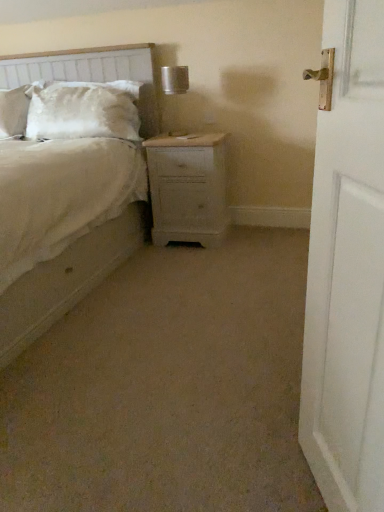
This screenshot has width=384, height=512. What are the coordinates of `beige fabric bed at center` in the screenshot? It's located at (67, 280).

In order to face light wood nightstand at center, should I rotate leftwards or rightwards?

To face it directly, rotate right by 0.158 degrees.

At what (x,y) coordinates should I click in order to perform the action: click on textured fabric headboard at upper left. Please return your answer as a coordinate pair (x, y). This screenshot has width=384, height=512. Looking at the image, I should click on (92, 73).

Where is `metallic silver table lamp at upper center`? This screenshot has height=512, width=384. metallic silver table lamp at upper center is located at coordinates (175, 79).

This screenshot has width=384, height=512. What do you see at coordinates (83, 110) in the screenshot?
I see `satin white pillow at upper left` at bounding box center [83, 110].

I want to click on white wooden door at right, so click(347, 270).

Considering the positions of objects satin white pillow at upper left and metallic silver table lamp at upper center in the image provided, who is in front, satin white pillow at upper left or metallic silver table lamp at upper center?

metallic silver table lamp at upper center is in front.

Can you confirm if satin white pillow at upper left is taller than metallic silver table lamp at upper center?

Yes.

Does point (102, 106) appear closer or farther from the camera than point (168, 82)?

Point (102, 106).

From a real-world perspective, which object stands above the other?

metallic silver table lamp at upper center is physically above.

Is light wood nightstand at center closer to the viewer compared to textured fabric headboard at upper left?

No, light wood nightstand at center is further to the viewer.

Can we say light wood nightstand at center lies outside textured fabric headboard at upper left?

Yes.

Considering the relative sizes of light wood nightstand at center and textured fabric headboard at upper left in the image provided, is light wood nightstand at center smaller than textured fabric headboard at upper left?

Yes, light wood nightstand at center is smaller than textured fabric headboard at upper left.

Which is correct: light wood nightstand at center is inside satin white pillow at upper left, or outside of it?

light wood nightstand at center lies outside satin white pillow at upper left.

Looking at their sizes, would you say light wood nightstand at center is wider or thinner than satin white pillow at upper left?

light wood nightstand at center is wider than satin white pillow at upper left.

The width and height of the screenshot is (384, 512). Identify the location of pillow above the light wood nightstand at center (from a real-world perspective). (83, 110).

Is satin white pillow at upper left to the right of white wooden door at right from the viewer's perspective?

In fact, satin white pillow at upper left is to the left of white wooden door at right.

Is satin white pillow at upper left facing away from white wooden door at right?

satin white pillow at upper left does not have its back to white wooden door at right.

Does satin white pillow at upper left have a greater width compared to white wooden door at right?

Yes.

From the image's perspective, between satin white pillow at upper left and white wooden door at right, which one is located above?

satin white pillow at upper left, from the image's perspective.

From the image's perspective, which is above, satin white pillow at upper left or light wood nightstand at center?

satin white pillow at upper left is shown above in the image.

Is satin white pillow at upper left looking in the opposite direction of light wood nightstand at center?

satin white pillow at upper left is not turned away from light wood nightstand at center.

Consider the image. From a real-world perspective, between satin white pillow at upper left and light wood nightstand at center, who is vertically lower?

light wood nightstand at center, from a real-world perspective.

Looking at this image, is satin white pillow at upper left bigger or smaller than light wood nightstand at center?

In the image, satin white pillow at upper left appears to be smaller than light wood nightstand at center.

Choose the correct answer: Is white wooden door at right inside beige fabric bed at center or outside it?

The correct answer is: outside.

Considering the positions of objects white wooden door at right and beige fabric bed at center in the image provided, who is more to the left, white wooden door at right or beige fabric bed at center?

Positioned to the left is beige fabric bed at center.

Is point (343, 173) closer or farther from the camera than point (0, 357)?

Point (343, 173) is closer to the camera than point (0, 357).

In the scene shown: From a real-world perspective, which object stands above the other?

beige fabric bed at center.

Considering the positions of points (104, 59) and (185, 185), is point (104, 59) closer to camera compared to point (185, 185)?

No, (104, 59) is further to viewer.

From a real-world perspective, which object stands above the other?

From a 3D spatial view, textured fabric headboard at upper left is above.

Which is more to the left, textured fabric headboard at upper left or light wood nightstand at center?

textured fabric headboard at upper left.

Which is behind, textured fabric headboard at upper left or light wood nightstand at center?

light wood nightstand at center.

You are a GUI agent. You are given a task and a screenshot of the screen. Output one action in this format:
    pyautogui.click(x=<x>, y=<y>)
    Task: Click on the table lamp positioned vertically above the satin white pillow at upper left (from a real-world perspective)
    The width and height of the screenshot is (384, 512).
    Given the screenshot: What is the action you would take?
    pyautogui.click(x=175, y=79)

The image size is (384, 512). In order to click on nightstand behind the textured fabric headboard at upper left in this screenshot , I will do `click(188, 188)`.

In the scene shown: Looking at the image, which one is located closer to metallic silver table lamp at upper center, white wooden door at right or textured fabric headboard at upper left?

textured fabric headboard at upper left is positioned closer to the anchor metallic silver table lamp at upper center.

Considering their positions, is textured fabric headboard at upper left positioned closer to metallic silver table lamp at upper center than white wooden door at right?

→ textured fabric headboard at upper left.

Considering their positions, is textured fabric headboard at upper left positioned closer to light wood nightstand at center than beige fabric bed at center?

beige fabric bed at center is closer to light wood nightstand at center.

Estimate the real-world distances between objects in this image. Which object is further from beige fabric bed at center, white wooden door at right or light wood nightstand at center?

white wooden door at right is further to beige fabric bed at center.

Considering their positions, is satin white pillow at upper left positioned closer to light wood nightstand at center than beige fabric bed at center?

beige fabric bed at center.

Which object lies further to the anchor point satin white pillow at upper left, beige fabric bed at center or metallic silver table lamp at upper center?

The object further to satin white pillow at upper left is beige fabric bed at center.

From the image, which object appears to be farther from white wooden door at right, satin white pillow at upper left or textured fabric headboard at upper left?

textured fabric headboard at upper left lies further to white wooden door at right than the other object.

When comparing their distances from satin white pillow at upper left, does light wood nightstand at center or white wooden door at right seem further?

The object further to satin white pillow at upper left is white wooden door at right.

I want to click on nightstand between beige fabric bed at center and satin white pillow at upper left from front to back, so click(x=188, y=188).

In order to click on headboard located between beige fabric bed at center and satin white pillow at upper left in the depth direction in this screenshot , I will do `click(92, 73)`.

I want to click on nightstand between white wooden door at right and metallic silver table lamp at upper center along the z-axis, so click(x=188, y=188).

Locate an element on the screen. Image resolution: width=384 pixels, height=512 pixels. headboard positioned between white wooden door at right and light wood nightstand at center from near to far is located at coordinates (92, 73).